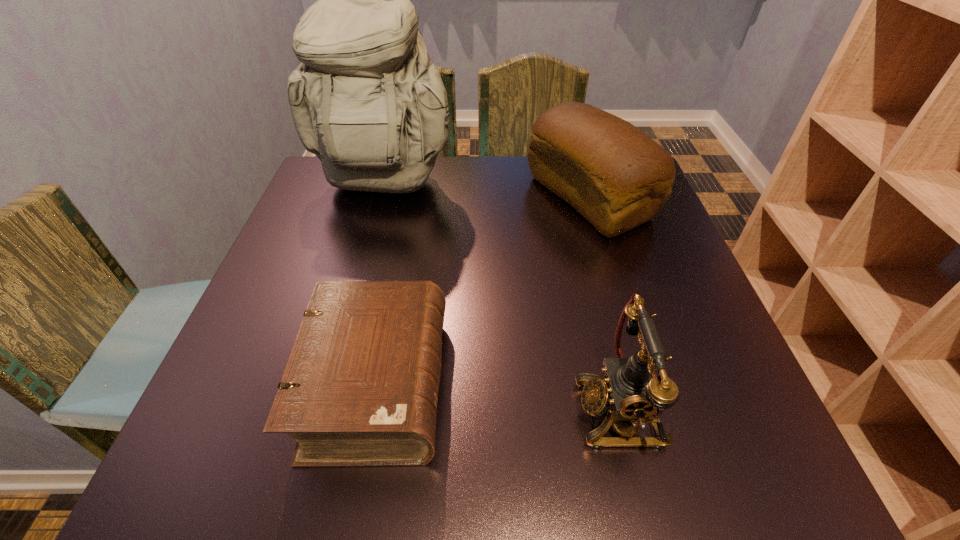
You are a GUI agent. You are given a task and a screenshot of the screen. Output one action in this format:
    pyautogui.click(x=<x>, y=<y>)
    Task: Click on the free space between the bread and the telephone
    This screenshot has width=960, height=540.
    Given the screenshot: What is the action you would take?
    pyautogui.click(x=605, y=304)

Locate an element on the screen. The height and width of the screenshot is (540, 960). free space between the bread and the telephone is located at coordinates (605, 304).

In order to click on vacant point located between the telephone and the backpack in this screenshot , I will do `click(501, 298)`.

Identify which object is the third closest to the backpack. Please provide its 2D coordinates. Your answer should be formatted as a tuple, i.e. [(x, y)], where the tuple contains the x and y coordinates of a point satisfying the conditions above.

[(634, 392)]

Identify which object is located as the nearest to the bread. Please provide its 2D coordinates. Your answer should be formatted as a tuple, i.e. [(x, y)], where the tuple contains the x and y coordinates of a point satisfying the conditions above.

[(367, 100)]

In order to click on vacant position in the image that satisfies the following two spatial constraints: 1. on the front side of the bread; 2. on the front of the telephone, featuring the rotary dial in this screenshot , I will do `click(653, 410)`.

The width and height of the screenshot is (960, 540). I want to click on vacant space that satisfies the following two spatial constraints: 1. on the front-facing side of the tallest object; 2. on the left side of the bread, so click(x=380, y=198).

Identify the location of free space in the image that satisfies the following two spatial constraints: 1. on the front-facing side of the tallest object; 2. on the left side of the bread. The height and width of the screenshot is (540, 960). (380, 198).